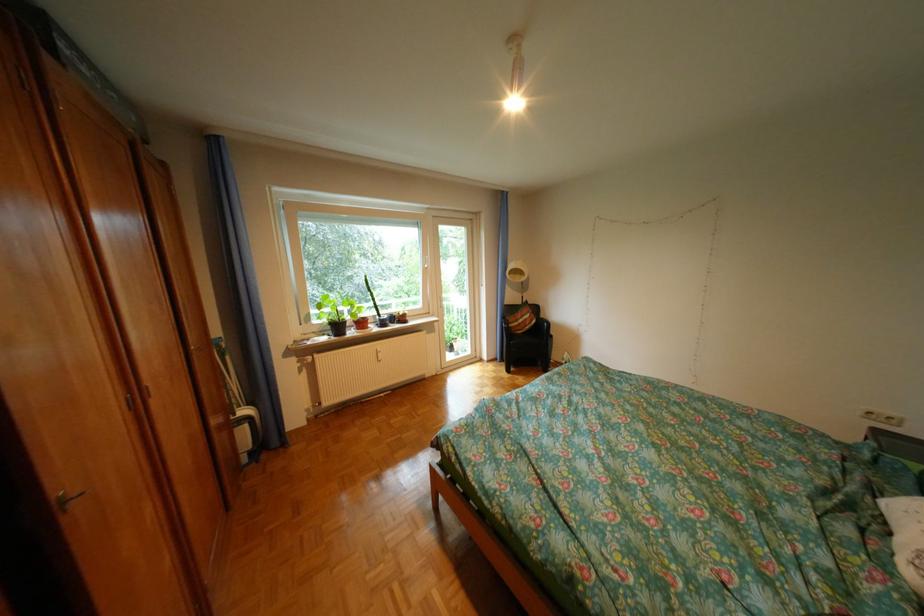
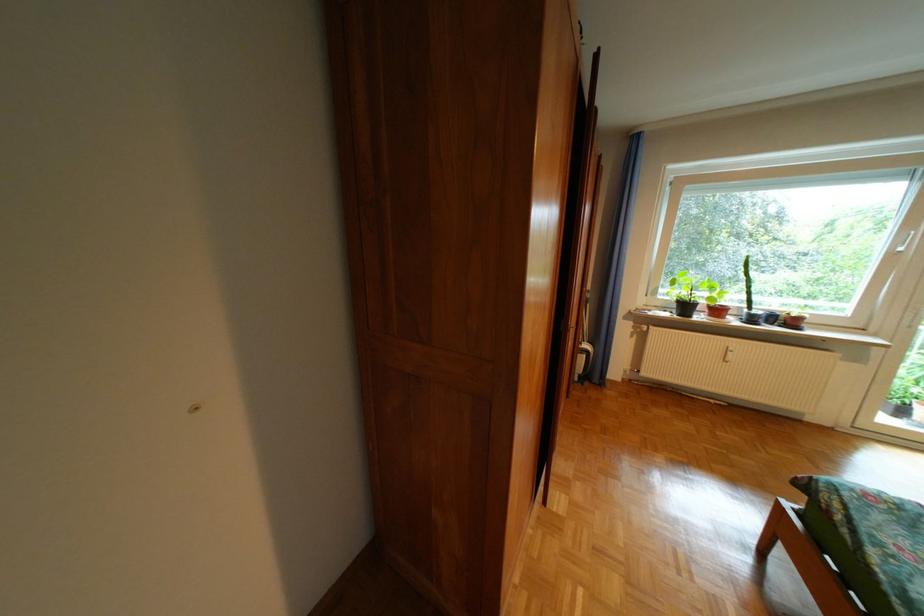
Locate, in the second image, the point that corresponds to point 367,333 in the first image.

(714, 318)